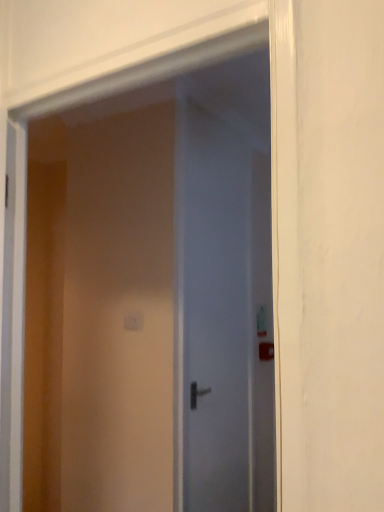
Question: Which direction should I rotate to face white glossy door at center, which is the 2th door in back-to-front order, — up or down?

Choices:
 (A) down
 (B) up

Answer: (A)

Question: From a real-world perspective, is satin white door at center, which is the 1th door from back to front, on top of white glossy door at center, the first door positioned from the front?

Choices:
 (A) yes
 (B) no

Answer: (B)

Question: Is satin white door at center, which is the second door from front to back, positioned behind white glossy door at center, the first door positioned from the front?

Choices:
 (A) no
 (B) yes

Answer: (B)

Question: Can you confirm if satin white door at center, which is the 1th door from back to front, is positioned to the left of white glossy door at center, the first door positioned from the front?

Choices:
 (A) no
 (B) yes

Answer: (A)

Question: Considering the relative sizes of satin white door at center, which is the 1th door from back to front, and white glossy door at center, the first door positioned from the front, in the image provided, is satin white door at center, which is the 1th door from back to front, taller than white glossy door at center, the first door positioned from the front,?

Choices:
 (A) yes
 (B) no

Answer: (A)

Question: Is satin white door at center, which is the 1th door from back to front, facing towards white glossy door at center, the first door positioned from the front?

Choices:
 (A) no
 (B) yes

Answer: (A)

Question: Is satin white door at center, which is the 1th door from back to front, bigger than white glossy door at center, which is the 2th door in back-to-front order?

Choices:
 (A) no
 (B) yes

Answer: (A)

Question: Considering the relative positions of white glossy door at center, which is the 2th door in back-to-front order, and white plastic light switch at center in the image provided, is white glossy door at center, which is the 2th door in back-to-front order, to the right of white plastic light switch at center from the viewer's perspective?

Choices:
 (A) yes
 (B) no

Answer: (A)

Question: From a real-world perspective, is white glossy door at center, which is the 2th door in back-to-front order, beneath white plastic light switch at center?

Choices:
 (A) no
 (B) yes

Answer: (A)

Question: Are white glossy door at center, the first door positioned from the front, and white plastic light switch at center beside each other?

Choices:
 (A) yes
 (B) no

Answer: (B)

Question: From the image's perspective, is white glossy door at center, the first door positioned from the front, below white plastic light switch at center?

Choices:
 (A) no
 (B) yes

Answer: (A)

Question: Does white glossy door at center, which is the 2th door in back-to-front order, have a lesser width compared to white plastic light switch at center?

Choices:
 (A) no
 (B) yes

Answer: (A)

Question: Is white glossy door at center, the first door positioned from the front, oriented away from white plastic light switch at center?

Choices:
 (A) yes
 (B) no

Answer: (B)

Question: Is white glossy door at center, which is the 2th door in back-to-front order, positioned with its back to satin white door at center, which is the second door from front to back?

Choices:
 (A) no
 (B) yes

Answer: (B)